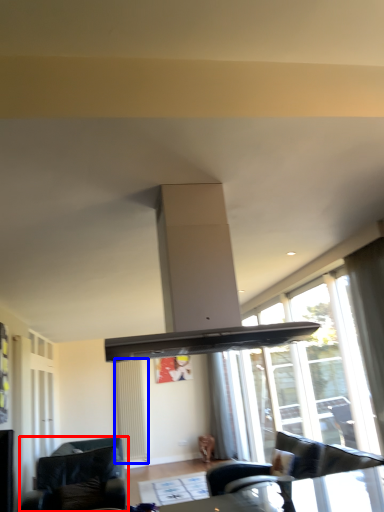
Question: Among these objects, which one is nearest to the camera, studio couch (highlighted by a red box) or radiator (highlighted by a blue box)?

Choices:
 (A) studio couch
 (B) radiator

Answer: (A)